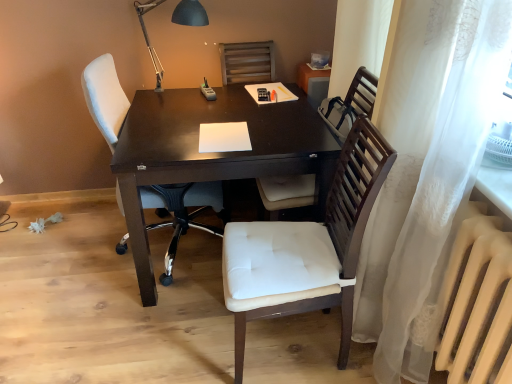
This screenshot has width=512, height=384. Find the location of `vacant space to the right of white paper at center`. vacant space to the right of white paper at center is located at coordinates (288, 129).